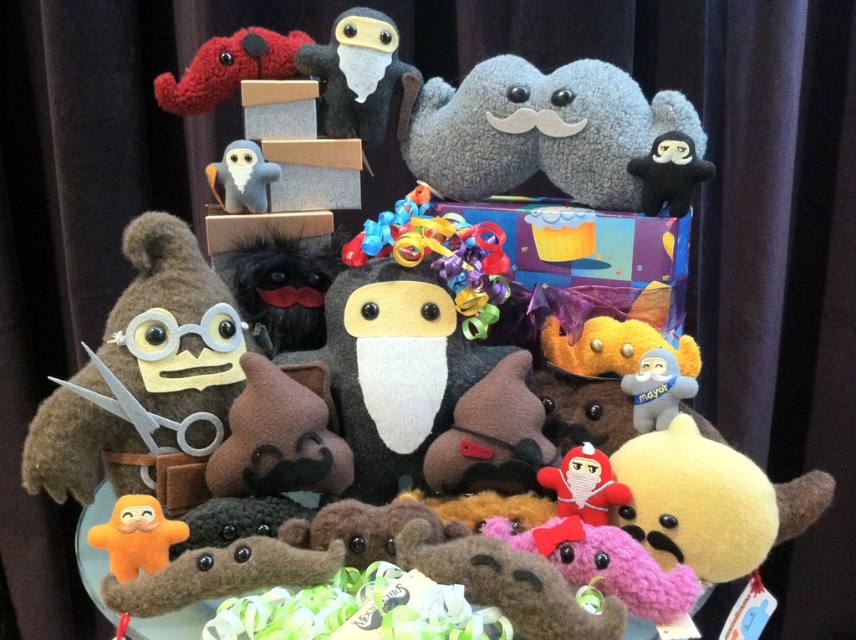
Question: Is red plush ninja at center positioned before gray felt owl at center?

Choices:
 (A) no
 (B) yes

Answer: (B)

Question: Which point appears farthest from the camera in this image?

Choices:
 (A) (675, 173)
 (B) (547, 467)
 (C) (203, 65)

Answer: (C)

Question: Which of these objects is positioned closest to the gray felt owl at center?

Choices:
 (A) orange plush toy at lower left
 (B) fluffy gray plush at center
 (C) yarn elephant at upper left

Answer: (C)

Question: Which object is the farthest from the yarn elephant at upper left?

Choices:
 (A) fluffy gray plush at center
 (B) velvety black monkey at upper right
 (C) gray felt owl at center

Answer: (B)

Question: Can you confirm if orange plush toy at lower left is smaller than gray plush toy at center?

Choices:
 (A) no
 (B) yes

Answer: (B)

Question: Can you confirm if orange plush toy at lower left is positioned above velvety black monkey at upper right?

Choices:
 (A) no
 (B) yes

Answer: (A)